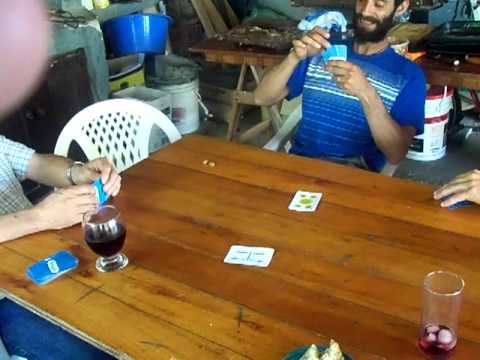
At what (x,y) coordinates should I click in order to perform the action: click on basin. Please return your answer as a coordinate pair (x, y). Looking at the image, I should click on (141, 40).